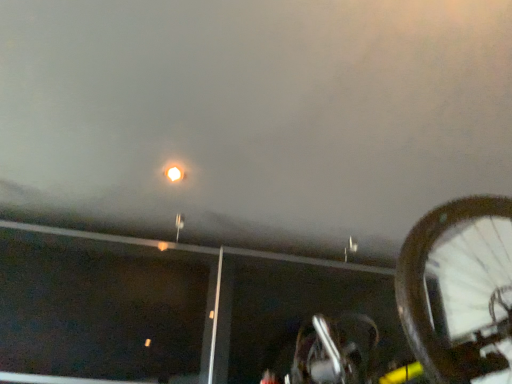
The height and width of the screenshot is (384, 512). Describe the element at coordinates (350, 248) in the screenshot. I see `metallic silver street light at upper center` at that location.

This screenshot has height=384, width=512. I want to click on metallic silver street light at upper center, so click(350, 248).

Measure the distance between point (352, 246) and camera.

They are 7.05 feet apart.

Measure the distance between shiny metallic bicycle at lower right and camera.

74.29 centimeters.

Describe the element at coordinates (458, 293) in the screenshot. I see `shiny metallic bicycle at lower right` at that location.

Where is `shiny metallic bicycle at lower right`? Image resolution: width=512 pixels, height=384 pixels. shiny metallic bicycle at lower right is located at coordinates (458, 293).

Where is `metallic silver street light at upper center`? The height and width of the screenshot is (384, 512). metallic silver street light at upper center is located at coordinates (350, 248).

Is metallic silver street light at upper center to the left of shiny metallic bicycle at lower right from the viewer's perspective?

Yes.

Which object is closer to the camera, metallic silver street light at upper center or shiny metallic bicycle at lower right?

shiny metallic bicycle at lower right.

Is point (346, 247) less distant than point (502, 372)?

No.

Looking at this image, from the image's perspective, is metallic silver street light at upper center above or below shiny metallic bicycle at lower right?

metallic silver street light at upper center is situated higher than shiny metallic bicycle at lower right in the image.

From a real-world perspective, is metallic silver street light at upper center positioned above or below shiny metallic bicycle at lower right?

From a real-world perspective, metallic silver street light at upper center is physically above shiny metallic bicycle at lower right.

From the picture: Considering the relative sizes of metallic silver street light at upper center and shiny metallic bicycle at lower right in the image provided, is metallic silver street light at upper center thinner than shiny metallic bicycle at lower right?

Yes, metallic silver street light at upper center is thinner than shiny metallic bicycle at lower right.

Between metallic silver street light at upper center and shiny metallic bicycle at lower right, which one has less height?

With less height is metallic silver street light at upper center.

Looking at this image, which of these two, metallic silver street light at upper center or shiny metallic bicycle at lower right, is bigger?

shiny metallic bicycle at lower right is bigger.

Can shiny metallic bicycle at lower right be found inside metallic silver street light at upper center?

That's incorrect, shiny metallic bicycle at lower right is not inside metallic silver street light at upper center.

Can you see metallic silver street light at upper center touching shiny metallic bicycle at lower right?

No, metallic silver street light at upper center is not in contact with shiny metallic bicycle at lower right.

Is metallic silver street light at upper center oriented towards shiny metallic bicycle at lower right?

No, metallic silver street light at upper center is not facing towards shiny metallic bicycle at lower right.

This screenshot has height=384, width=512. In order to click on bicycle on the right of metallic silver street light at upper center in this screenshot , I will do `click(458, 293)`.

Can you confirm if shiny metallic bicycle at lower right is positioned to the left of metallic silver street light at upper center?

In fact, shiny metallic bicycle at lower right is to the right of metallic silver street light at upper center.

Relative to metallic silver street light at upper center, is shiny metallic bicycle at lower right in front or behind?

shiny metallic bicycle at lower right is positioned closer to the viewer than metallic silver street light at upper center.

Does point (443, 258) come behind point (348, 239)?

Yes, it is behind point (348, 239).

From the image's perspective, which object appears higher, shiny metallic bicycle at lower right or metallic silver street light at upper center?

metallic silver street light at upper center is shown above in the image.

From a real-world perspective, is shiny metallic bicycle at lower right physically above metallic silver street light at upper center?

No, from a real-world perspective, shiny metallic bicycle at lower right is not over metallic silver street light at upper center

Does shiny metallic bicycle at lower right have a lesser width compared to metallic silver street light at upper center?

Incorrect, the width of shiny metallic bicycle at lower right is not less than that of metallic silver street light at upper center.

Is shiny metallic bicycle at lower right taller or shorter than metallic silver street light at upper center?

Clearly, shiny metallic bicycle at lower right is taller compared to metallic silver street light at upper center.

In the scene shown: Considering the sizes of shiny metallic bicycle at lower right and metallic silver street light at upper center in the image, is shiny metallic bicycle at lower right bigger or smaller than metallic silver street light at upper center?

In the image, shiny metallic bicycle at lower right appears to be larger than metallic silver street light at upper center.

Is shiny metallic bicycle at lower right not within metallic silver street light at upper center?

Yes, shiny metallic bicycle at lower right is outside of metallic silver street light at upper center.

Is shiny metallic bicycle at lower right beside metallic silver street light at upper center?

No, shiny metallic bicycle at lower right is not next to metallic silver street light at upper center.

Is shiny metallic bicycle at lower right aimed at metallic silver street light at upper center?

No, shiny metallic bicycle at lower right is not oriented towards metallic silver street light at upper center.

What's the angular difference between shiny metallic bicycle at lower right and metallic silver street light at upper center's facing directions?

shiny metallic bicycle at lower right and metallic silver street light at upper center are facing 91.6 degrees away from each other.

The width and height of the screenshot is (512, 384). Find the location of `street light behind the shiny metallic bicycle at lower right`. street light behind the shiny metallic bicycle at lower right is located at coordinates (350, 248).

At what (x,y) coordinates should I click in order to perform the action: click on street light lying above the shiny metallic bicycle at lower right (from the image's perspective). Please return your answer as a coordinate pair (x, y). This screenshot has height=384, width=512. Looking at the image, I should click on (350, 248).

Where is `street light above the shiny metallic bicycle at lower right (from a real-world perspective)`? Image resolution: width=512 pixels, height=384 pixels. street light above the shiny metallic bicycle at lower right (from a real-world perspective) is located at coordinates (350, 248).